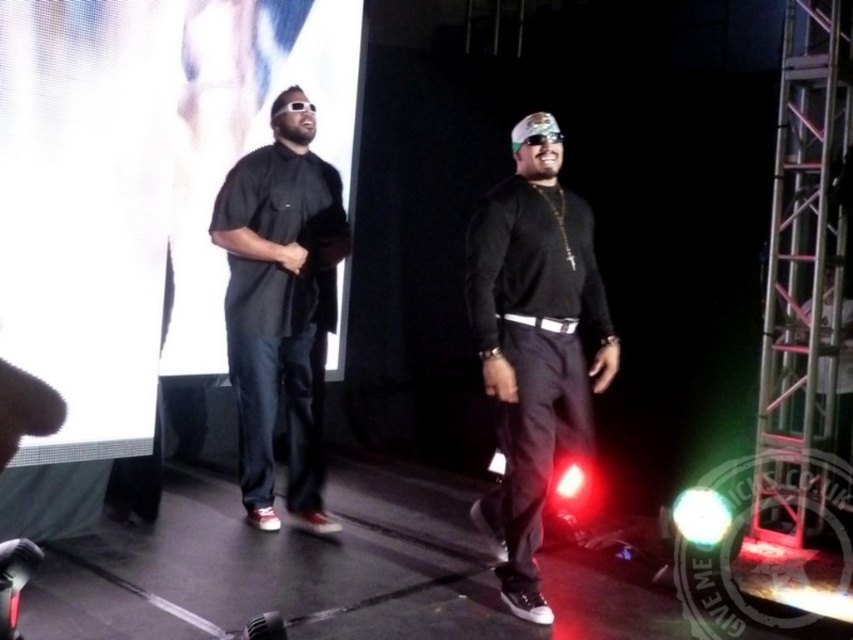
You are an event coordinator arranging a stage setup. You need to position two performers so that one is to the left of the other. Given the current arrangement, which performer should move to the left to achieve this? The performers are the black matte shirt at center and the matte black shirt at center.

The matte black shirt at center should move to the left of the black matte shirt at center to achieve the desired arrangement.

You are organizing a costume party and need to ensure that all attendees have matching outfits. You notice two individuals on stage wearing black shirts. The first is wearing a black matte shirt at center, and the second is wearing a matte black shirt at center. Which of these shirts is larger in size?

The black matte shirt at center is larger in size compared to the matte black shirt at center.

You are sitting in the front row of the concert hall and see two performers on stage. You notice a black matte shirt at center and a matte black shirt at center. Which one is nearer to you?

The black matte shirt at center is closer to the viewer than the matte black shirt at center.